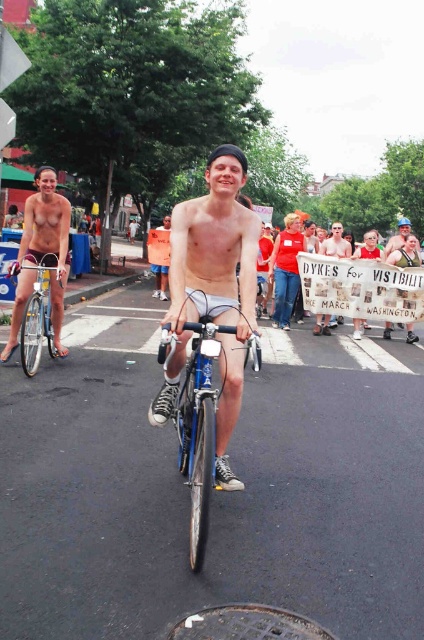
Can you confirm if gray metallic manhole cover at lower center is positioned to the right of matte white sign at center?

No, gray metallic manhole cover at lower center is not to the right of matte white sign at center.

What do you see at coordinates (247, 624) in the screenshot? The width and height of the screenshot is (424, 640). I see `gray metallic manhole cover at lower center` at bounding box center [247, 624].

You are a GUI agent. You are given a task and a screenshot of the screen. Output one action in this format:
    pyautogui.click(x=<x>, y=<y>)
    Task: Click on the gray metallic manhole cover at lower center
    
    Given the screenshot: What is the action you would take?
    pyautogui.click(x=247, y=624)

Is shiny blue frame at center to the left of gray metallic manhole cover at lower center from the viewer's perspective?

Yes, shiny blue frame at center is to the left of gray metallic manhole cover at lower center.

Where is `shiny blue frame at center`? The height and width of the screenshot is (640, 424). shiny blue frame at center is located at coordinates (200, 428).

Is point (219, 637) more distant than point (161, 272)?

No, it is not.

Between gray metallic manhole cover at lower center and orange cotton shorts at center, which one is positioned lower?

gray metallic manhole cover at lower center is below.

What do you see at coordinates (247, 624) in the screenshot?
I see `gray metallic manhole cover at lower center` at bounding box center [247, 624].

This screenshot has height=640, width=424. I want to click on gray metallic manhole cover at lower center, so click(247, 624).